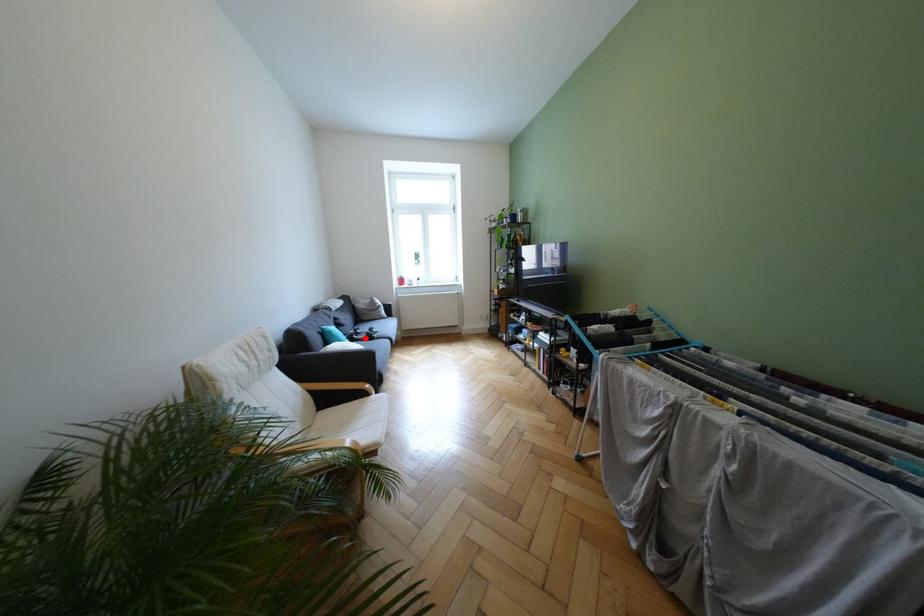
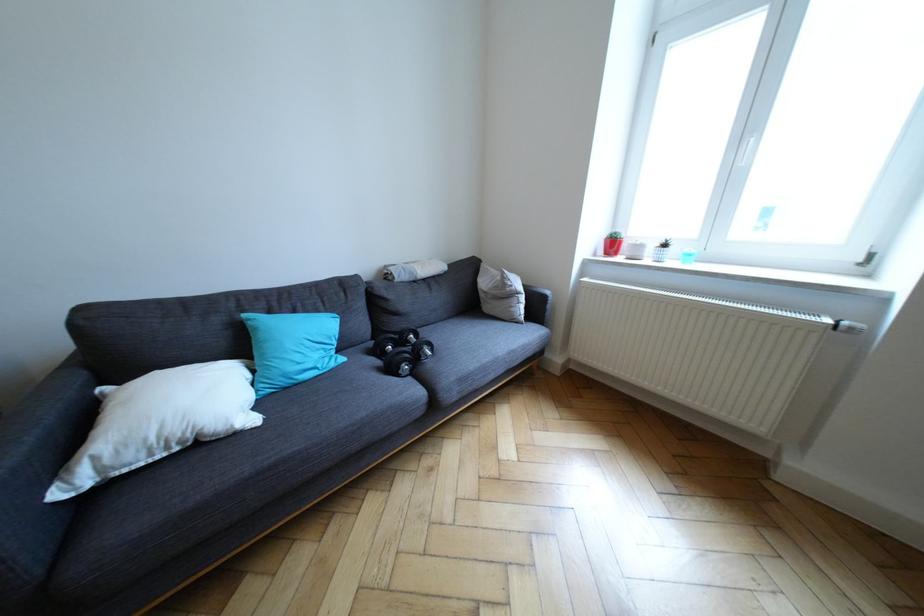
Where in the second image is the point corresponding to the highlighted location from the first image?

(399, 347)